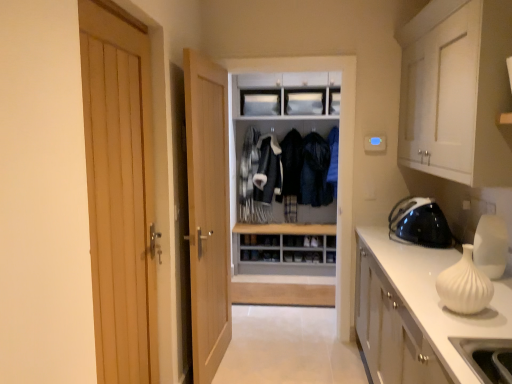
Find the location of a particular element. The width and height of the screenshot is (512, 384). free area below white matte vase at right (from a real-world perspective) is located at coordinates (451, 311).